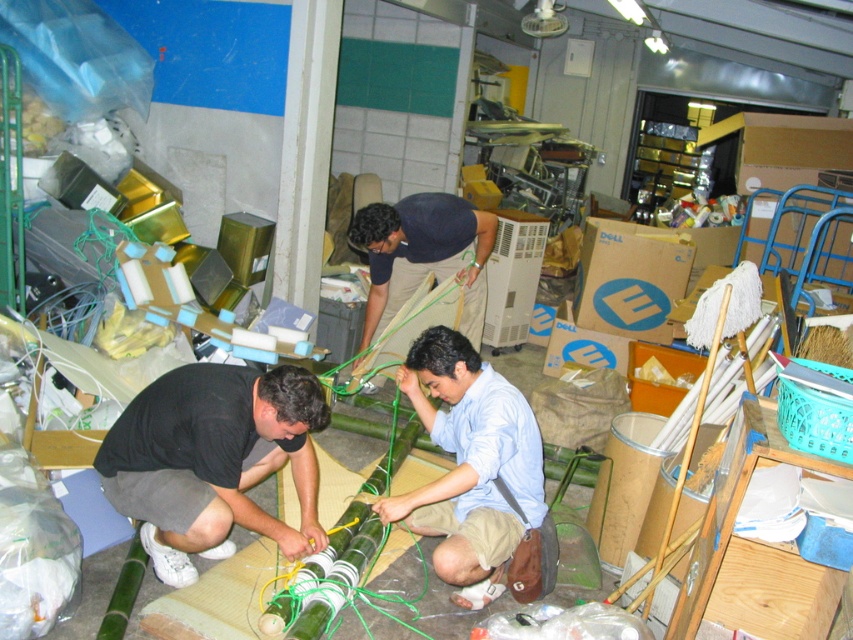
Question: From the image, what is the correct spatial relationship of black matte shirt at lower left in relation to light blue cotton shirt at center?

Choices:
 (A) right
 (B) left

Answer: (B)

Question: Which point is farther to the camera?

Choices:
 (A) matte black shirt at center
 (B) black matte shirt at lower left

Answer: (A)

Question: Which point is closer to the camera taking this photo?

Choices:
 (A) (387, 212)
 (B) (494, 573)

Answer: (B)

Question: Which of the following is the closest to the observer?

Choices:
 (A) matte black shirt at center
 (B) black matte shirt at lower left

Answer: (B)

Question: Is light blue cotton shirt at center smaller than matte black shirt at center?

Choices:
 (A) no
 (B) yes

Answer: (B)

Question: Does light blue cotton shirt at center appear on the left side of matte black shirt at center?

Choices:
 (A) yes
 (B) no

Answer: (B)